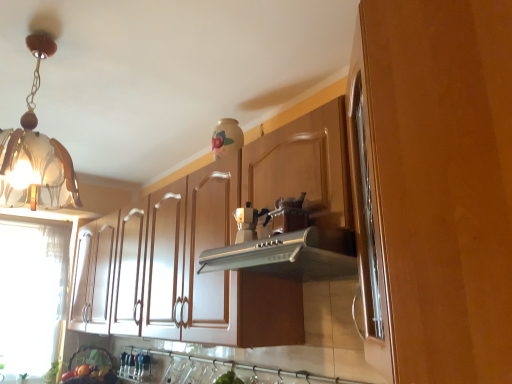
Question: In which direction should I rotate to look at wooden cabinet at center, marked as the 1th cabinetry in a front-to-back arrangement?

Choices:
 (A) right
 (B) left

Answer: (A)

Question: Is the position of silver metallic vent at center less distant than that of wooden cabinet at center, the second cabinetry viewed from the back?

Choices:
 (A) no
 (B) yes

Answer: (A)

Question: From the image's perspective, is silver metallic vent at center under wooden cabinet at center, the second cabinetry viewed from the back?

Choices:
 (A) yes
 (B) no

Answer: (A)

Question: From a real-world perspective, is silver metallic vent at center physically above wooden cabinet at center, the second cabinetry viewed from the back?

Choices:
 (A) yes
 (B) no

Answer: (B)

Question: Does silver metallic vent at center contain wooden cabinet at center, marked as the 1th cabinetry in a front-to-back arrangement?

Choices:
 (A) yes
 (B) no

Answer: (B)

Question: Is silver metallic vent at center bigger than wooden cabinet at center, marked as the 1th cabinetry in a front-to-back arrangement?

Choices:
 (A) yes
 (B) no

Answer: (B)

Question: Does silver metallic vent at center have a greater width compared to wooden cabinet at center, the second cabinetry viewed from the back?

Choices:
 (A) yes
 (B) no

Answer: (B)

Question: Is translucent glass pendant light at upper left closer to camera compared to wooden cabinet at center, the second cabinetry viewed from the back?

Choices:
 (A) no
 (B) yes

Answer: (A)

Question: Considering the relative sizes of translucent glass pendant light at upper left and wooden cabinet at center, the second cabinetry viewed from the back, in the image provided, is translucent glass pendant light at upper left smaller than wooden cabinet at center, the second cabinetry viewed from the back,?

Choices:
 (A) yes
 (B) no

Answer: (A)

Question: From a real-world perspective, is translucent glass pendant light at upper left positioned under wooden cabinet at center, marked as the 1th cabinetry in a front-to-back arrangement, based on gravity?

Choices:
 (A) no
 (B) yes

Answer: (A)

Question: Does translucent glass pendant light at upper left have a greater width compared to wooden cabinet at center, marked as the 1th cabinetry in a front-to-back arrangement?

Choices:
 (A) yes
 (B) no

Answer: (B)

Question: Is translucent glass pendant light at upper left positioned behind wooden cabinet at center, marked as the 1th cabinetry in a front-to-back arrangement?

Choices:
 (A) no
 (B) yes

Answer: (B)

Question: From a real-world perspective, is translucent glass pendant light at upper left over wooden cabinet at center, marked as the 1th cabinetry in a front-to-back arrangement?

Choices:
 (A) yes
 (B) no

Answer: (A)

Question: Considering the relative sizes of matte brown cabinet at center, the first cabinetry in the back-to-front sequence, and matte silver coffee machine at center in the image provided, is matte brown cabinet at center, the first cabinetry in the back-to-front sequence, taller than matte silver coffee machine at center?

Choices:
 (A) no
 (B) yes

Answer: (B)